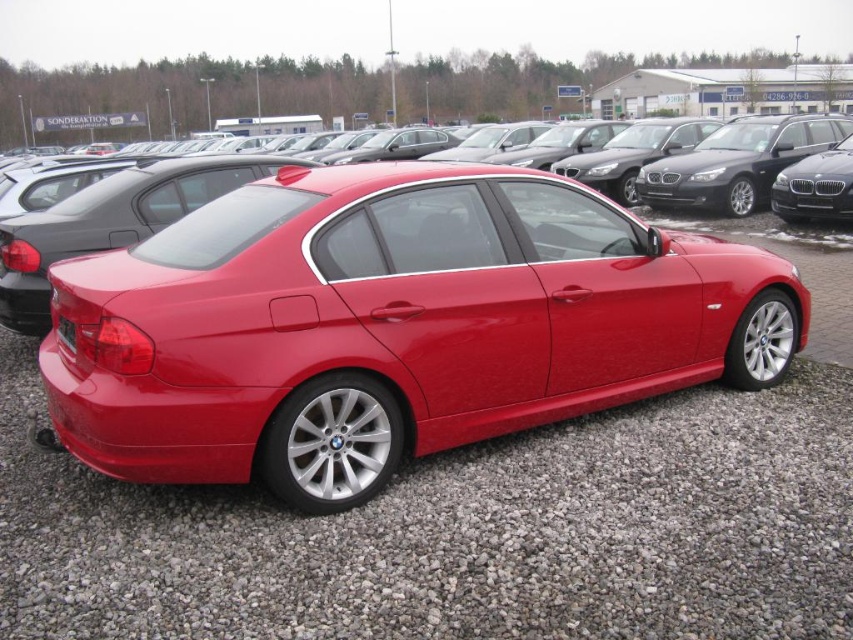
Question: Which of the following is the farthest from the observer?

Choices:
 (A) glossy metallic sedan at center
 (B) red gravel at lower center
 (C) black plastic license plate at rear

Answer: (C)

Question: Does glossy metallic sedan at center have a lesser width compared to black plastic license plate at rear?

Choices:
 (A) yes
 (B) no

Answer: (B)

Question: Which point is farther to the camera?

Choices:
 (A) (482, 524)
 (B) (317, 353)

Answer: (B)

Question: Is red gravel at lower center positioned before black plastic license plate at rear?

Choices:
 (A) no
 (B) yes

Answer: (B)

Question: Where is glossy metallic sedan at center located in relation to black plastic license plate at rear in the image?

Choices:
 (A) left
 (B) right

Answer: (B)

Question: Which point appears closest to the camera in this image?

Choices:
 (A) (375, 502)
 (B) (230, 376)
 (C) (73, 337)

Answer: (B)